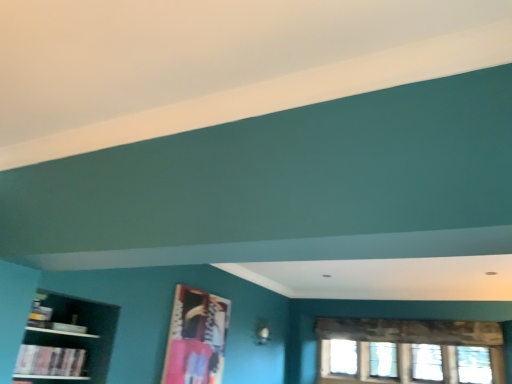
The image size is (512, 384). What do you see at coordinates (68, 341) in the screenshot?
I see `dark wood shelf at left` at bounding box center [68, 341].

Identify the location of metallic silver picture frame at center. (196, 338).

This screenshot has height=384, width=512. I want to click on dark wood shelf at left, so pyautogui.click(x=68, y=341).

Is clear glass window at lower right facing towards dark wood shelf at left?

Yes, clear glass window at lower right faces towards dark wood shelf at left.

From the image's perspective, relative to dark wood shelf at left, is clear glass window at lower right above or below?

From the image's perspective, clear glass window at lower right appears below dark wood shelf at left.

Which is behind, point (475, 337) or point (67, 332)?

The point (475, 337) is farther.

Considering the positions of objects clear glass window at lower right and dark wood shelf at left in the image provided, who is behind, clear glass window at lower right or dark wood shelf at left?

clear glass window at lower right is behind.

Does point (203, 318) come farther from viewer compared to point (45, 376)?

Yes, it is behind point (45, 376).

Which of these two, metallic silver picture frame at center or dark wood shelf at left, stands taller?

With more height is metallic silver picture frame at center.

From a real-world perspective, is metallic silver picture frame at center on dark wood shelf at left?

Yes, from a real-world perspective, metallic silver picture frame at center is above dark wood shelf at left.

From the picture: Considering the sizes of metallic silver picture frame at center and dark wood shelf at left in the image, is metallic silver picture frame at center bigger or smaller than dark wood shelf at left?

In the image, metallic silver picture frame at center appears to be smaller than dark wood shelf at left.

Is hardcover book at lower left spatially inside clear glass window at lower right, or outside of it?

hardcover book at lower left is spatially situated outside clear glass window at lower right.

Which is in front, point (45, 369) or point (322, 339)?

The point (45, 369) is closer.

How many degrees apart are the facing directions of hardcover book at lower left and clear glass window at lower right?

The angle between the facing direction of hardcover book at lower left and the facing direction of clear glass window at lower right is 86.2 degrees.

Is hardcover book at lower left bigger or smaller than clear glass window at lower right?

In the image, hardcover book at lower left appears to be smaller than clear glass window at lower right.

From the image's perspective, is hardcover book at lower left located above dark wood shelf at left?

No, from the image's perspective, hardcover book at lower left is not above dark wood shelf at left.

Is hardcover book at lower left in front of dark wood shelf at left?

No, the depth of hardcover book at lower left is greater than that of dark wood shelf at left.

Which of these two, hardcover book at lower left or dark wood shelf at left, is wider?

dark wood shelf at left is wider.

Is hardcover book at lower left facing away from dark wood shelf at left?

Yes, hardcover book at lower left's orientation is away from dark wood shelf at left.

Is metallic silver picture frame at center far from clear glass window at lower right?

Yes, metallic silver picture frame at center and clear glass window at lower right are located far from each other.

Between metallic silver picture frame at center and clear glass window at lower right, which one has more height?

Standing taller between the two is metallic silver picture frame at center.

Is metallic silver picture frame at center situated inside clear glass window at lower right or outside?

metallic silver picture frame at center is not enclosed by clear glass window at lower right.

From the image's perspective, between dark wood shelf at left and hardcover book at lower left, who is located below?

From the image's view, hardcover book at lower left is below.

Is dark wood shelf at left to the left or to the right of hardcover book at lower left in the image?

dark wood shelf at left is to the left of hardcover book at lower left.

From the picture: From a real-world perspective, which is physically below, dark wood shelf at left or hardcover book at lower left?

hardcover book at lower left.

Can you confirm if dark wood shelf at left is shorter than hardcover book at lower left?

No.

Considering their positions, is clear glass window at lower right located in front of or behind metallic silver picture frame at center?

Clearly, clear glass window at lower right is behind metallic silver picture frame at center.

Considering the relative sizes of clear glass window at lower right and metallic silver picture frame at center in the image provided, is clear glass window at lower right bigger than metallic silver picture frame at center?

Correct, clear glass window at lower right is larger in size than metallic silver picture frame at center.

Do you think clear glass window at lower right is within metallic silver picture frame at center, or outside of it?

clear glass window at lower right cannot be found inside metallic silver picture frame at center.

Considering the positions of point (332, 378) and point (183, 314), is point (332, 378) closer or farther from the camera than point (183, 314)?

Clearly, point (332, 378) is more distant from the camera than point (183, 314).

The image size is (512, 384). What are the coordinates of `window on the right side of dark wood shelf at left` in the screenshot? It's located at (x=410, y=351).

At what (x,y) coordinates should I click in order to perform the action: click on picture frame above the dark wood shelf at left (from a real-world perspective). Please return your answer as a coordinate pair (x, y). The height and width of the screenshot is (384, 512). Looking at the image, I should click on (196, 338).

From the image, which object appears to be nearer to dark wood shelf at left, metallic silver picture frame at center or hardcover book at lower left?

hardcover book at lower left is positioned closer to the anchor dark wood shelf at left.

Looking at the image, which one is located closer to dark wood shelf at left, metallic silver picture frame at center or clear glass window at lower right?

The object closer to dark wood shelf at left is metallic silver picture frame at center.

From the image, which object appears to be nearer to metallic silver picture frame at center, hardcover book at lower left or dark wood shelf at left?

Among the two, dark wood shelf at left is located nearer to metallic silver picture frame at center.

When comparing their distances from metallic silver picture frame at center, does hardcover book at lower left or clear glass window at lower right seem further?

Based on the image, clear glass window at lower right appears to be further to metallic silver picture frame at center.

Estimate the real-world distances between objects in this image. Which object is further from hardcover book at lower left, metallic silver picture frame at center or dark wood shelf at left?

metallic silver picture frame at center is further to hardcover book at lower left.

Based on their spatial positions, is clear glass window at lower right or metallic silver picture frame at center closer to hardcover book at lower left?

Based on the image, metallic silver picture frame at center appears to be nearer to hardcover book at lower left.

In the scene shown: Looking at the image, which one is located closer to dark wood shelf at left, clear glass window at lower right or hardcover book at lower left?

Based on the image, hardcover book at lower left appears to be nearer to dark wood shelf at left.

Estimate the real-world distances between objects in this image. Which object is further from clear glass window at lower right, metallic silver picture frame at center or dark wood shelf at left?

Based on the image, dark wood shelf at left appears to be further to clear glass window at lower right.

The width and height of the screenshot is (512, 384). What are the coordinates of `picture frame located between dark wood shelf at left and clear glass window at lower right in the left-right direction` in the screenshot? It's located at (196, 338).

Find the location of a particular element. The height and width of the screenshot is (384, 512). book positioned between dark wood shelf at left and metallic silver picture frame at center from near to far is located at coordinates (50, 361).

You are a GUI agent. You are given a task and a screenshot of the screen. Output one action in this format:
    pyautogui.click(x=<x>, y=<y>)
    Task: Click on the picture frame located between hardcover book at lower left and clear glass window at lower right in the left-right direction
    Image resolution: width=512 pixels, height=384 pixels.
    Given the screenshot: What is the action you would take?
    [x=196, y=338]

This screenshot has height=384, width=512. Find the location of `book between dark wood shelf at left and clear glass window at lower right`. book between dark wood shelf at left and clear glass window at lower right is located at coordinates (50, 361).